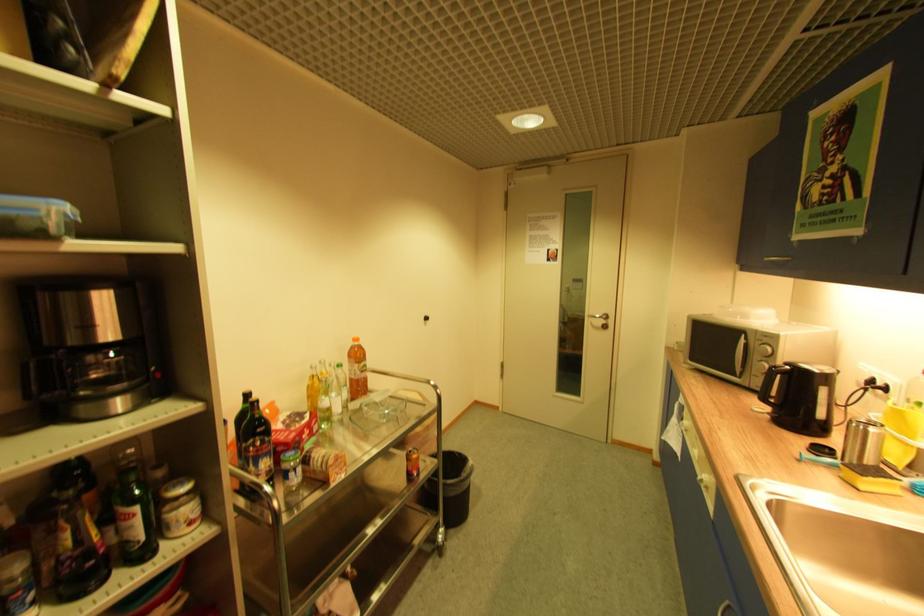
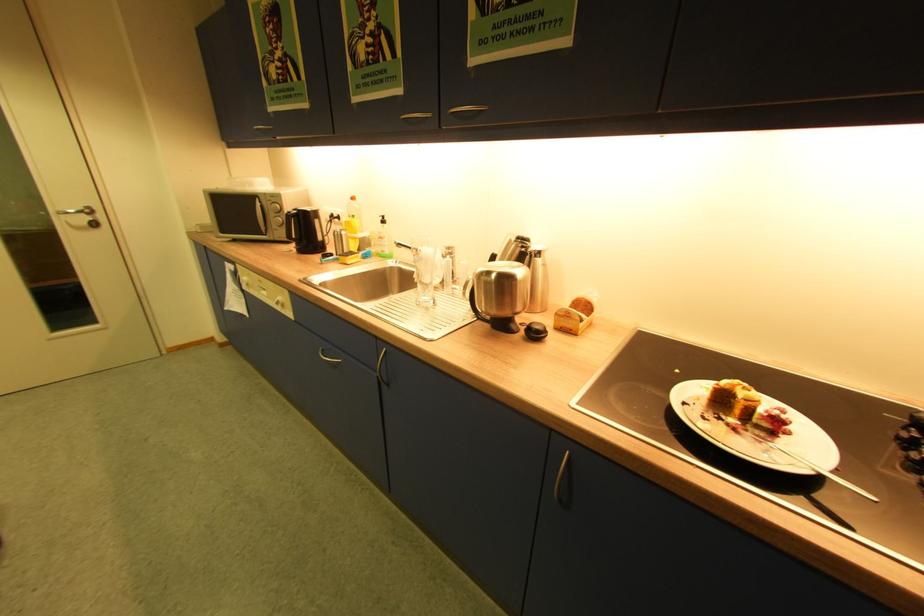
The point at (880, 430) is marked in the first image. Where is the corresponding point in the second image?

(348, 233)